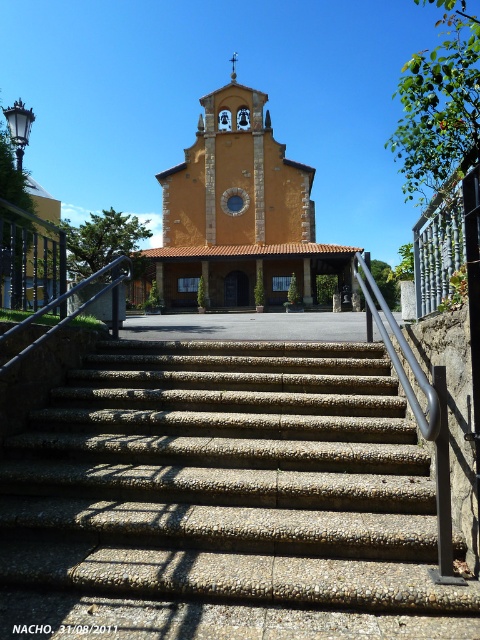
Question: Can you confirm if yellow stucco church at center is thinner than silver metallic handrail at center?

Choices:
 (A) no
 (B) yes

Answer: (A)

Question: Which point is farther to the camera?

Choices:
 (A) (120, 256)
 (B) (280, 477)
 (C) (186, 157)

Answer: (C)

Question: Does concrete textured stairs at center appear over yellow stucco church at center?

Choices:
 (A) no
 (B) yes

Answer: (A)

Question: Which of the following is the closest to the observer?

Choices:
 (A) silver metallic handrail at center
 (B) yellow stucco church at center
 (C) concrete textured stairs at center

Answer: (C)

Question: Based on their relative distances, which object is nearer to the silver metallic handrail at center?

Choices:
 (A) concrete textured stairs at center
 (B) yellow stucco church at center

Answer: (A)

Question: Is the position of concrete textured stairs at center more distant than that of silver metallic handrail at center?

Choices:
 (A) yes
 (B) no

Answer: (B)